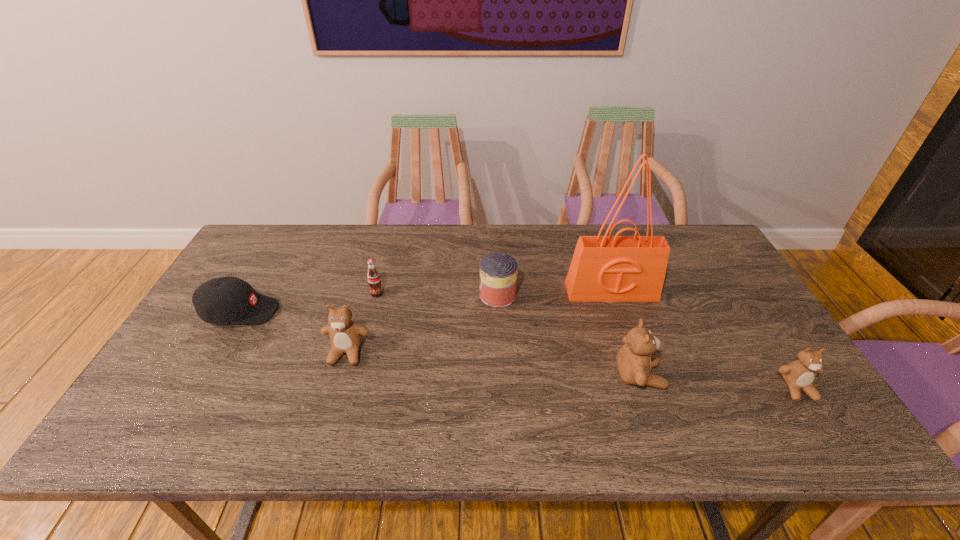
This screenshot has height=540, width=960. I want to click on free space between the tote bag and the rightmost teddy bear, so click(x=704, y=340).

Find the location of a particular element. This screenshot has height=540, width=960. vacant region between the second teddy bear from left to right and the fourth object from right to left is located at coordinates (568, 335).

Choose which object is the second nearest neighbor to the rightmost object. Please provide its 2D coordinates. Your answer should be formatted as a tuple, i.e. [(x, y)], where the tuple contains the x and y coordinates of a point satisfying the conditions above.

[(605, 268)]

What are the coordinates of `object that is the fourth closest to the second teddy bear from right to left` in the screenshot? It's located at (345, 335).

This screenshot has height=540, width=960. Find the location of `teddy bear that is the second closest one to the second teddy bear from left to right`. teddy bear that is the second closest one to the second teddy bear from left to right is located at coordinates (345, 335).

This screenshot has height=540, width=960. What are the coordinates of `teddy bear that is the second closest to the second shortest teddy bear` in the screenshot? It's located at (799, 375).

This screenshot has width=960, height=540. Find the location of `vacant space that satisfies the following two spatial constraints: 1. on the logo side of the tallest object; 2. with a logo on the front of the baseball cap`. vacant space that satisfies the following two spatial constraints: 1. on the logo side of the tallest object; 2. with a logo on the front of the baseball cap is located at coordinates (617, 312).

At what (x,y) coordinates should I click in order to perform the action: click on vacant space that satisfies the following two spatial constraints: 1. on the front side of the soda; 2. with a logo on the front of the baseball cap. Please return your answer as a coordinate pair (x, y). Looking at the image, I should click on (372, 312).

Where is `vacant space that satisfies the following two spatial constraints: 1. on the logo side of the tote bag; 2. with a logo on the front of the leftmost object`? The height and width of the screenshot is (540, 960). vacant space that satisfies the following two spatial constraints: 1. on the logo side of the tote bag; 2. with a logo on the front of the leftmost object is located at coordinates (617, 312).